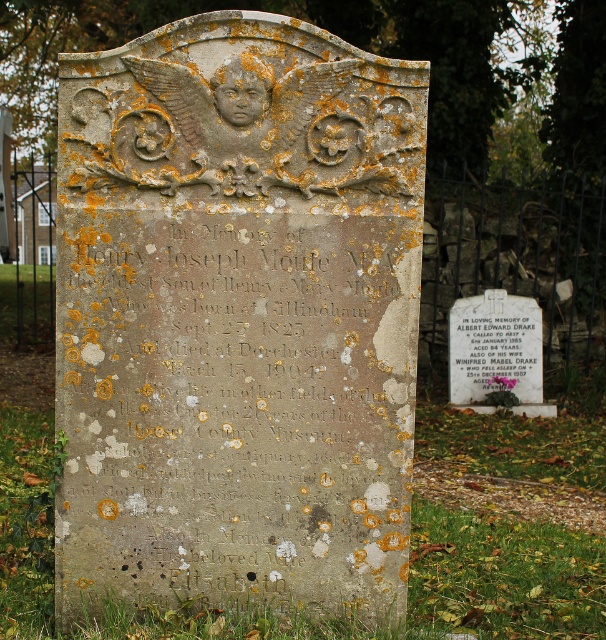
Question: Does speckled stone tombstone at center appear on the left side of white marble plaque at center?

Choices:
 (A) yes
 (B) no

Answer: (A)

Question: Considering the real-world distances, which object is closest to the white paper at center?

Choices:
 (A) speckled stone tombstone at center
 (B) white marble plaque at center

Answer: (B)

Question: Which point is closer to the camera?

Choices:
 (A) white paper at center
 (B) speckled stone tombstone at center

Answer: (B)

Question: Does white marble plaque at center appear over white paper at center?

Choices:
 (A) no
 (B) yes

Answer: (A)

Question: Can you confirm if speckled stone tombstone at center is wider than white paper at center?

Choices:
 (A) yes
 (B) no

Answer: (A)

Question: Which object appears closest to the camera in this image?

Choices:
 (A) white paper at center
 (B) speckled stone tombstone at center
 (C) white marble plaque at center

Answer: (B)